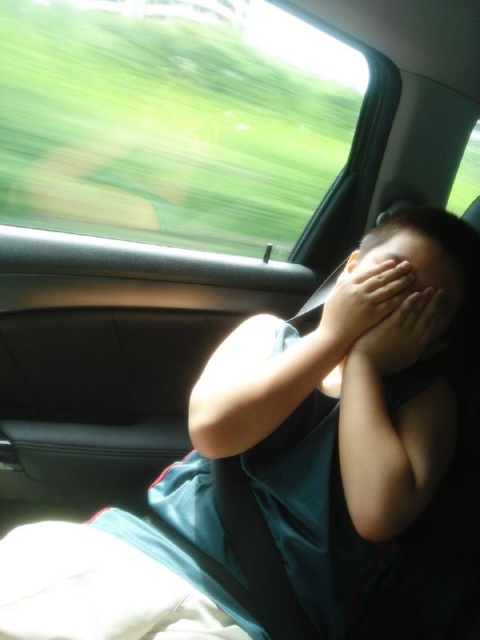
Between transparent glass car window at upper left and smooth skin head at center, which one has less height?

smooth skin head at center

Is point (335, 163) farther from viewer compared to point (446, 253)?

Yes, point (335, 163) is farther from viewer.

At what (x,y) coordinates should I click in order to perform the action: click on transparent glass car window at upper left. Please return your answer as a coordinate pair (x, y). Image resolution: width=480 pixels, height=640 pixels. Looking at the image, I should click on (171, 120).

The height and width of the screenshot is (640, 480). I want to click on transparent glass car window at upper left, so coord(171,120).

Describe the element at coordinates (171, 120) in the screenshot. I see `transparent glass car window at upper left` at that location.

Is transparent glass car window at upper left to the right of matte skin hand at center from the viewer's perspective?

Incorrect, transparent glass car window at upper left is not on the right side of matte skin hand at center.

At what (x,y) coordinates should I click in order to perform the action: click on transparent glass car window at upper left. Please return your answer as a coordinate pair (x, y). Looking at the image, I should click on (171, 120).

What do you see at coordinates (444, 252) in the screenshot? This screenshot has width=480, height=640. I see `smooth skin head at center` at bounding box center [444, 252].

Is point (479, 330) closer to viewer compared to point (396, 252)?

No, (479, 330) is behind (396, 252).

Find the location of a particular element. The width and height of the screenshot is (480, 640). smooth skin head at center is located at coordinates (444, 252).